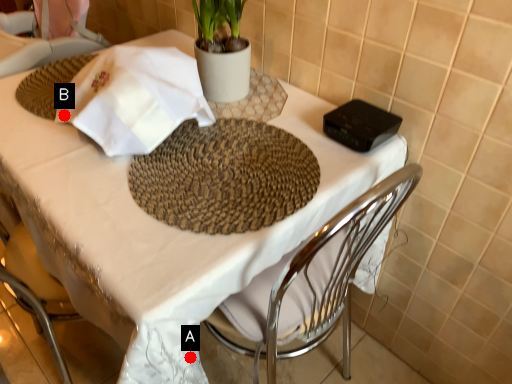
Question: Two points are circled on the image, labeled by A and B beside each circle. Which point is closer to the camera?

Choices:
 (A) A is closer
 (B) B is closer

Answer: (A)